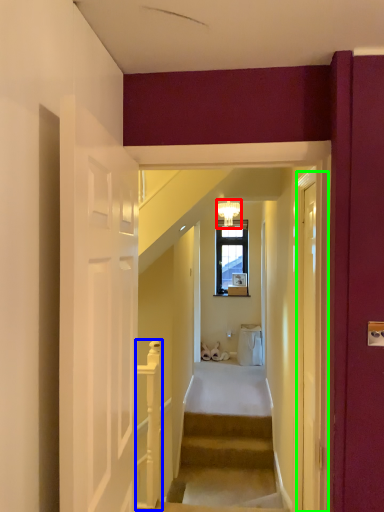
Question: Which object is the farthest from light fixture (highlighted by a red box)? Choose among these: rail (highlighted by a blue box) or glass door (highlighted by a green box).

Choices:
 (A) rail
 (B) glass door

Answer: (B)